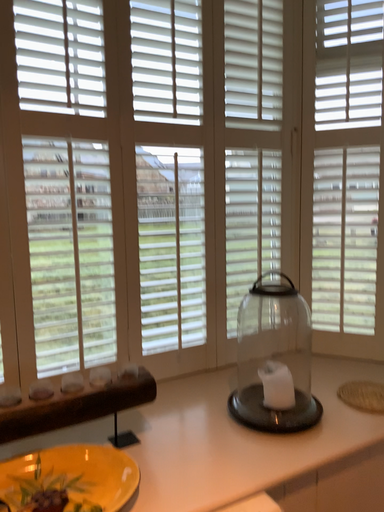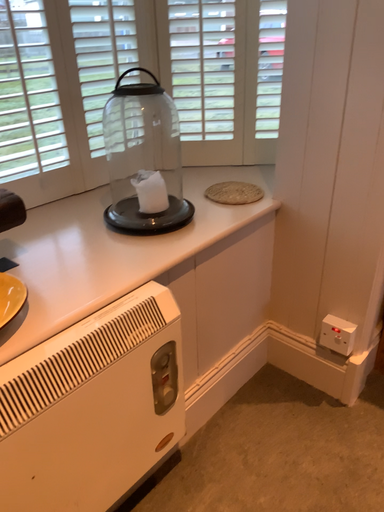
Question: Which way did the camera rotate in the video?

Choices:
 (A) rotated downward
 (B) rotated upward

Answer: (A)